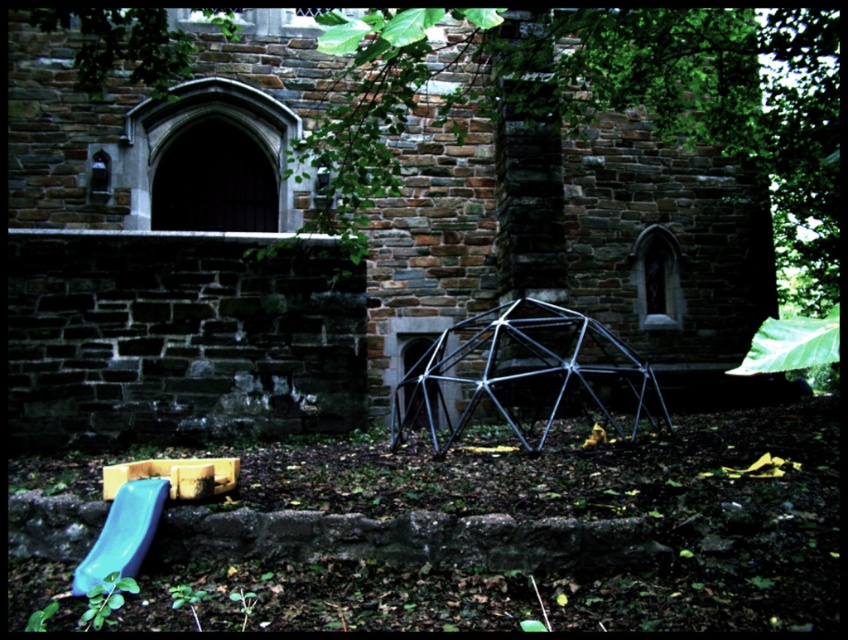
Is stone church at center to the left of metallic silver geodesic dome at center from the viewer's perspective?

Yes, stone church at center is to the left of metallic silver geodesic dome at center.

Who is positioned more to the right, stone church at center or metallic silver geodesic dome at center?

Positioned to the right is metallic silver geodesic dome at center.

The width and height of the screenshot is (848, 640). Find the location of `stone church at center`. stone church at center is located at coordinates (327, 248).

Is metallic silver geodesic dome at center further to camera compared to matte plastic slide at lower left?

Yes, metallic silver geodesic dome at center is further from the viewer.

Is metallic silver geodesic dome at center wider than matte plastic slide at lower left?

Indeed, metallic silver geodesic dome at center has a greater width compared to matte plastic slide at lower left.

Which is behind, point (539, 384) or point (127, 557)?

Point (539, 384)

Find the location of a particular element. Image resolution: width=848 pixels, height=640 pixels. metallic silver geodesic dome at center is located at coordinates (522, 374).

Can you confirm if stone church at center is positioned to the right of matte plastic slide at lower left?

Indeed, stone church at center is positioned on the right side of matte plastic slide at lower left.

Is point (202, 106) closer to viewer compared to point (141, 524)?

No, (202, 106) is further to viewer.

Locate an element on the screen. The width and height of the screenshot is (848, 640). stone church at center is located at coordinates (327, 248).